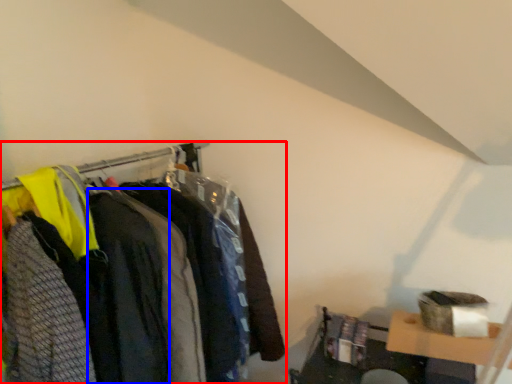
Question: Which object appears closest to the camera in this image, closet (highlighted by a red box) or clothing (highlighted by a blue box)?

Choices:
 (A) closet
 (B) clothing

Answer: (A)